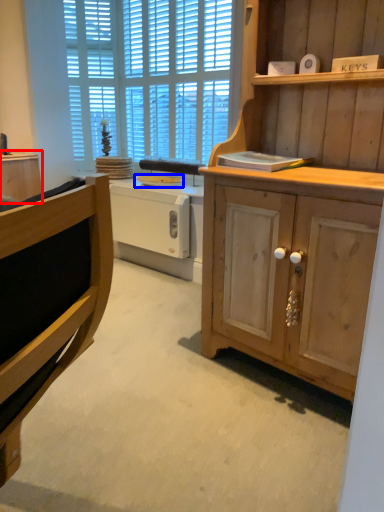
Question: Among these objects, which one is farthest to the camera, cabinetry (highlighted by a red box) or appliance (highlighted by a blue box)?

Choices:
 (A) cabinetry
 (B) appliance

Answer: (A)